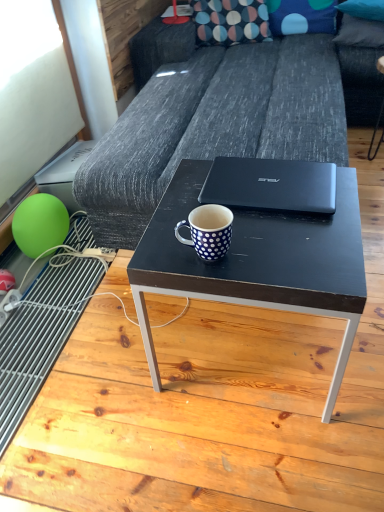
Question: Does black matte table at center have a lesser width compared to black matte laptop at center?

Choices:
 (A) no
 (B) yes

Answer: (A)

Question: Is the position of black matte table at center less distant than that of black matte laptop at center?

Choices:
 (A) yes
 (B) no

Answer: (A)

Question: Is black matte table at center taller than black matte laptop at center?

Choices:
 (A) no
 (B) yes

Answer: (B)

Question: From the image's perspective, does black matte table at center appear lower than black matte laptop at center?

Choices:
 (A) yes
 (B) no

Answer: (A)

Question: Is black matte table at center looking in the opposite direction of black matte laptop at center?

Choices:
 (A) yes
 (B) no

Answer: (B)

Question: Does point (175, 188) appear closer or farther from the camera than point (337, 424)?

Choices:
 (A) closer
 (B) farther

Answer: (B)

Question: Is matte black coffee table at center inside the boundaries of black matte table at center, or outside?

Choices:
 (A) inside
 (B) outside

Answer: (B)

Question: In terms of height, does matte black coffee table at center look taller or shorter compared to black matte table at center?

Choices:
 (A) short
 (B) tall

Answer: (B)

Question: Relative to black matte table at center, is matte black coffee table at center in front or behind?

Choices:
 (A) behind
 (B) front

Answer: (A)

Question: From the image's perspective, is matte black coffee table at center above or below blue dotted fabric pillow at upper center, the second pillow from the right?

Choices:
 (A) below
 (B) above

Answer: (A)

Question: Is point (200, 283) positioned closer to the camera than point (314, 5)?

Choices:
 (A) farther
 (B) closer

Answer: (B)

Question: Looking at the image, does matte black coffee table at center seem bigger or smaller compared to blue dotted fabric pillow at upper center, the 2th pillow in the left-to-right sequence?

Choices:
 (A) big
 (B) small

Answer: (A)

Question: In the image, is matte black coffee table at center positioned in front of or behind blue dotted fabric pillow at upper center, the 2th pillow in the left-to-right sequence?

Choices:
 (A) behind
 (B) front

Answer: (B)

Question: Is blue dotted fabric pillow at upper center, the second pillow from the right, in front of or behind blue dotted fabric pillow at upper right, the third pillow positioned from the left, in the image?

Choices:
 (A) behind
 (B) front

Answer: (A)

Question: In terms of width, does blue dotted fabric pillow at upper center, the 2th pillow in the left-to-right sequence, look wider or thinner when compared to blue dotted fabric pillow at upper right, the 1th pillow in the right-to-left sequence?

Choices:
 (A) thin
 (B) wide

Answer: (A)